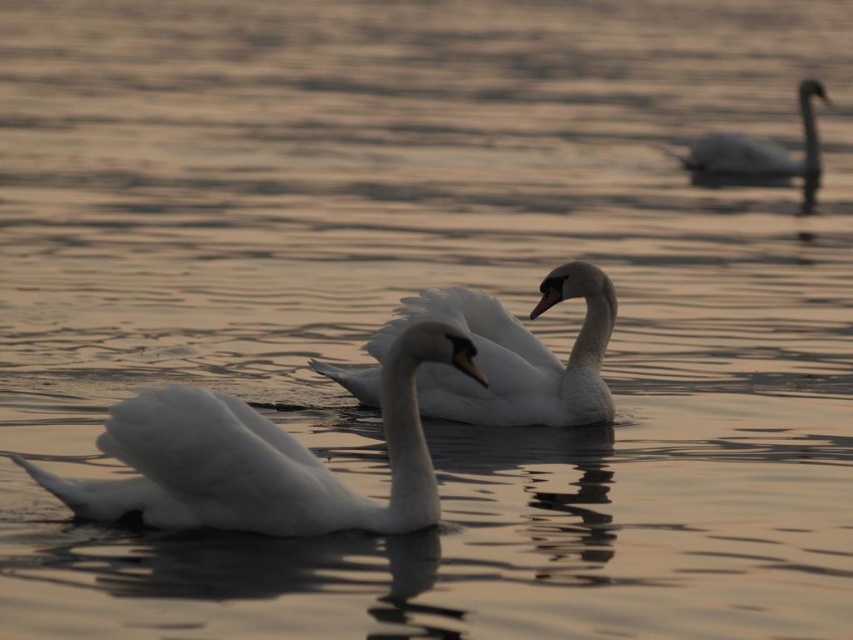
Question: Can you confirm if white glossy swan at center is bigger than white glossy swan at upper right?

Choices:
 (A) no
 (B) yes

Answer: (B)

Question: Based on their relative distances, which object is farther from the white glossy swan at upper right?

Choices:
 (A) white feathered swan at center
 (B) white glossy swan at center

Answer: (A)

Question: Can you confirm if white feathered swan at center is positioned above white glossy swan at center?

Choices:
 (A) yes
 (B) no

Answer: (B)

Question: Is white glossy swan at center wider than white glossy swan at upper right?

Choices:
 (A) yes
 (B) no

Answer: (A)

Question: Among these points, which one is farthest from the camera?

Choices:
 (A) (107, 426)
 (B) (474, 404)

Answer: (B)

Question: Which point appears closest to the camera in this image?

Choices:
 (A) (809, 147)
 (B) (590, 397)
 (C) (396, 410)

Answer: (C)